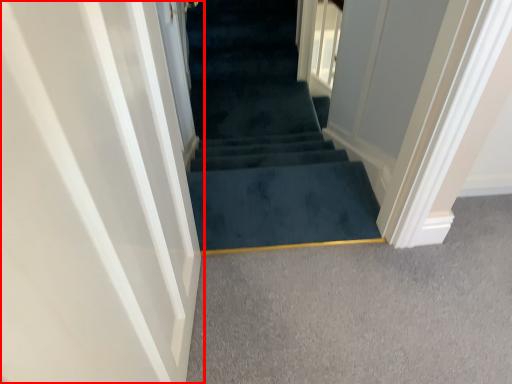
Question: In this image, where is door (annotated by the red box) located relative to stairs?

Choices:
 (A) right
 (B) left

Answer: (B)